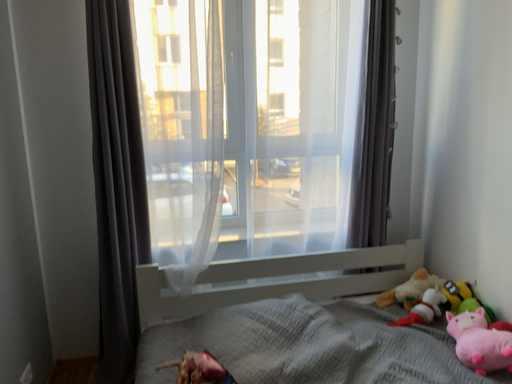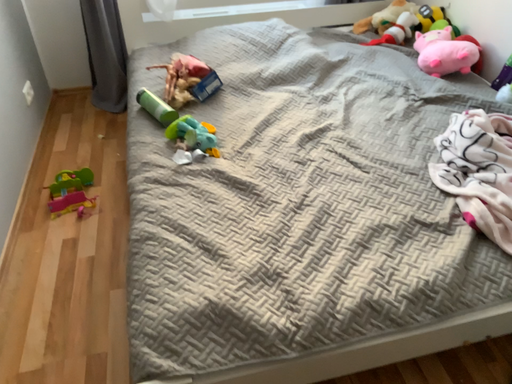
Question: How did the camera likely rotate when shooting the video?

Choices:
 (A) rotated downward
 (B) rotated upward

Answer: (A)